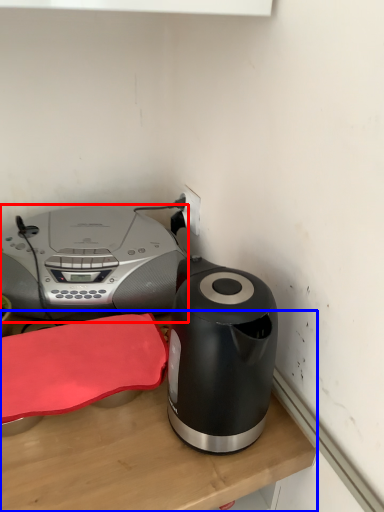
Question: Which of the following is the farthest to the observer, home appliance (highlighted by a red box) or table (highlighted by a blue box)?

Choices:
 (A) home appliance
 (B) table

Answer: (A)